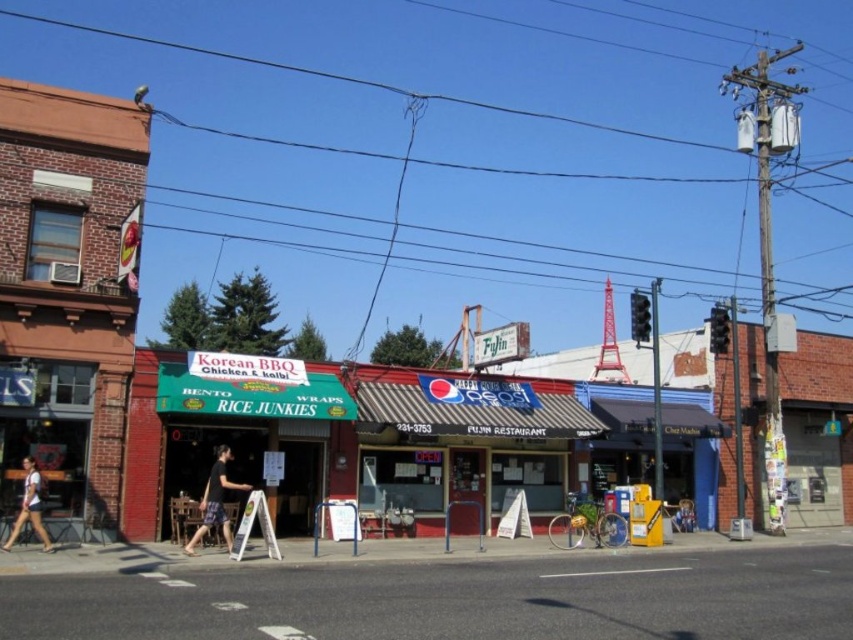
From the picture: You are standing on a sidewalk and want to cross the street to reach the restaurant Rice Junkies. The crosswalk is located at the smooth asphalt road at lower center. If your walking speed is 1.5 meters per second, how many seconds will it take you to reach the crosswalk?

The smooth asphalt road at lower center is 7.95 meters away from the viewer. At a walking speed of 1.5 meters per second, it would take approximately 5.3 seconds to reach the crosswalk.